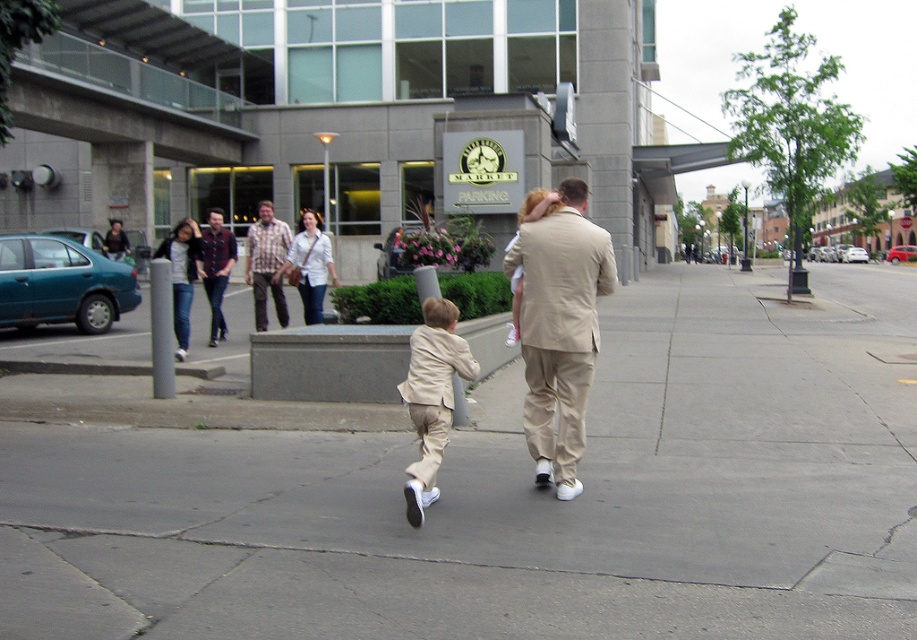
You are standing at the origin point of the image coordinate system. There is a matte khaki suit at center located at point (x=559, y=328). If you want to walk towards it, which direction should you move?

The matte khaki suit at center is located at point (x=559, y=328). Since the coordinate system origin is at the bottom left corner, you should move towards the upper right direction to reach it.